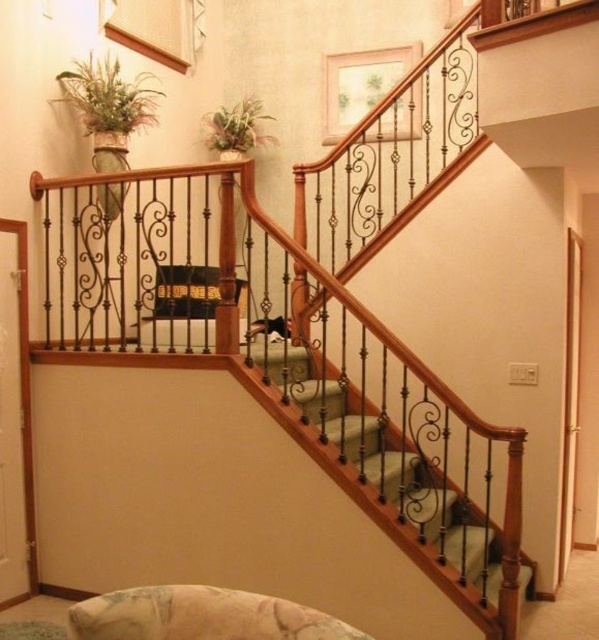
Who is more forward, (128, 307) or (114, 115)?

Point (114, 115) is more forward.

Between point (216, 172) and point (152, 76), which one is positioned behind?

The point (152, 76) is behind.

Where is `wrought iron railing at center`? The width and height of the screenshot is (599, 640). wrought iron railing at center is located at coordinates (294, 365).

Does green carpeted stairs at center appear on the left side of green leafy plant at upper center?

Incorrect, green carpeted stairs at center is not on the left side of green leafy plant at upper center.

Does green carpeted stairs at center have a larger size compared to green leafy plant at upper center?

Indeed, green carpeted stairs at center has a larger size compared to green leafy plant at upper center.

What do you see at coordinates (403, 474) in the screenshot?
I see `green carpeted stairs at center` at bounding box center [403, 474].

Identify the location of green carpeted stairs at center. (403, 474).

Does wrought iron railing at center have a lesser width compared to green leafy plant at upper center?

In fact, wrought iron railing at center might be wider than green leafy plant at upper center.

Looking at this image, does wrought iron railing at center have a greater width compared to green leafy plant at upper center?

Correct, the width of wrought iron railing at center exceeds that of green leafy plant at upper center.

The height and width of the screenshot is (640, 599). What do you see at coordinates (294, 365) in the screenshot?
I see `wrought iron railing at center` at bounding box center [294, 365].

Locate an element on the screen. The image size is (599, 640). wrought iron railing at center is located at coordinates (x=294, y=365).